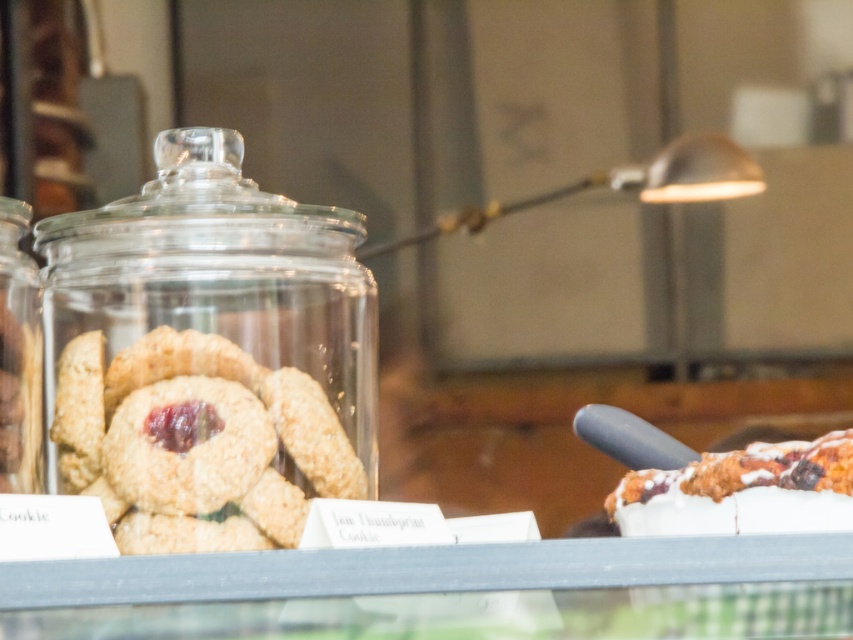
You are a customer in the bakery and want to buy both the transparent glass jar at left and the glazed sugar cookie at right. The cashier says you need to place them in a bag that can only hold items if the cookie is to the right of the jar. Based on their current positions, is this possible?

Yes, because the transparent glass jar at left is already positioned to the left of the glazed sugar cookie at right, so placing them in the bag with the cookie to the right of the jar is possible.

You are a customer at the bakery and want to take a photo of both the transparent glass jar at left and the glazed sugar cookie at right. Which object should you focus on first to ensure both are in the frame?

You should focus on the transparent glass jar at left first because it is closer to you than the glazed sugar cookie at right, so adjusting the camera to capture it ensures the cookie will also be in the frame.